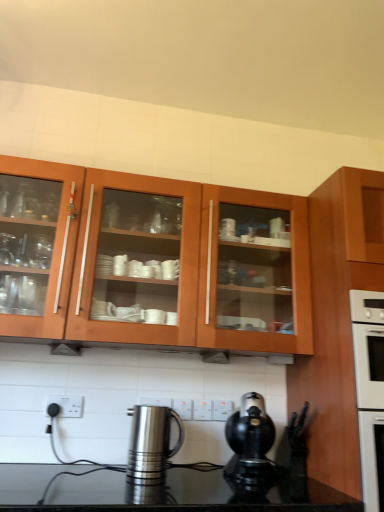
Question: Which direction should I rotate to look at white plastic electric outlet at lower center, marked as the first electric outlet in a left-to-right arrangement?

Choices:
 (A) right
 (B) left

Answer: (B)

Question: Can you confirm if wooden cabinet at right, the first cabinetry from the right, is taller than white plastic electric outlet at center, marked as the first electric outlet in a back-to-front arrangement?

Choices:
 (A) no
 (B) yes

Answer: (B)

Question: Is wooden cabinet at right, marked as the second cabinetry in a left-to-right arrangement, not within white plastic electric outlet at center, marked as the first electric outlet in a back-to-front arrangement?

Choices:
 (A) no
 (B) yes

Answer: (B)

Question: From the image's perspective, is wooden cabinet at right, the first cabinetry from the right, below white plastic electric outlet at center, positioned as the third electric outlet in left-to-right order?

Choices:
 (A) no
 (B) yes

Answer: (A)

Question: Is wooden cabinet at right, marked as the second cabinetry in a left-to-right arrangement, facing towards white plastic electric outlet at center, positioned as the third electric outlet in left-to-right order?

Choices:
 (A) yes
 (B) no

Answer: (B)

Question: Considering the relative sizes of wooden cabinet at right, marked as the second cabinetry in a left-to-right arrangement, and white plastic electric outlet at center, acting as the first electric outlet starting from the right, in the image provided, is wooden cabinet at right, marked as the second cabinetry in a left-to-right arrangement, bigger than white plastic electric outlet at center, acting as the first electric outlet starting from the right,?

Choices:
 (A) no
 (B) yes

Answer: (B)

Question: Is wooden cabinet at right, marked as the second cabinetry in a left-to-right arrangement, in front of white plastic electric outlet at center, positioned as the third electric outlet in left-to-right order?

Choices:
 (A) no
 (B) yes

Answer: (B)

Question: Considering the relative sizes of polished stainless steel kettle at lower center, which appears as the 1th kitchen appliance when viewed from the left, and white plastic electric outlet at lower center, marked as the first electric outlet in a left-to-right arrangement, in the image provided, is polished stainless steel kettle at lower center, which appears as the 1th kitchen appliance when viewed from the left, taller than white plastic electric outlet at lower center, marked as the first electric outlet in a left-to-right arrangement,?

Choices:
 (A) yes
 (B) no

Answer: (A)

Question: Does polished stainless steel kettle at lower center, which appears as the 1th kitchen appliance when viewed from the left, appear on the left side of white plastic electric outlet at lower center, marked as the first electric outlet in a left-to-right arrangement?

Choices:
 (A) no
 (B) yes

Answer: (A)

Question: Is polished stainless steel kettle at lower center, which appears as the 1th kitchen appliance when viewed from the left, positioned beyond the bounds of white plastic electric outlet at lower center, marked as the first electric outlet in a left-to-right arrangement?

Choices:
 (A) no
 (B) yes

Answer: (B)

Question: Is polished stainless steel kettle at lower center, which appears as the 1th kitchen appliance when viewed from the left, looking in the opposite direction of white plastic electric outlet at lower center, acting as the first electric outlet starting from the front?

Choices:
 (A) no
 (B) yes

Answer: (A)

Question: From the image's perspective, is polished stainless steel kettle at lower center, the second kitchen appliance from the right, below white plastic electric outlet at lower center, which is the third electric outlet in right-to-left order?

Choices:
 (A) yes
 (B) no

Answer: (A)

Question: Can you confirm if polished stainless steel kettle at lower center, the second kitchen appliance from the right, is thinner than white plastic electric outlet at lower center, acting as the first electric outlet starting from the front?

Choices:
 (A) no
 (B) yes

Answer: (A)

Question: From the image's perspective, is white plastic electric outlet at center, the 2th electric outlet in the left-to-right sequence, on top of wooden cabinet at right, the first cabinetry from the right?

Choices:
 (A) yes
 (B) no

Answer: (B)